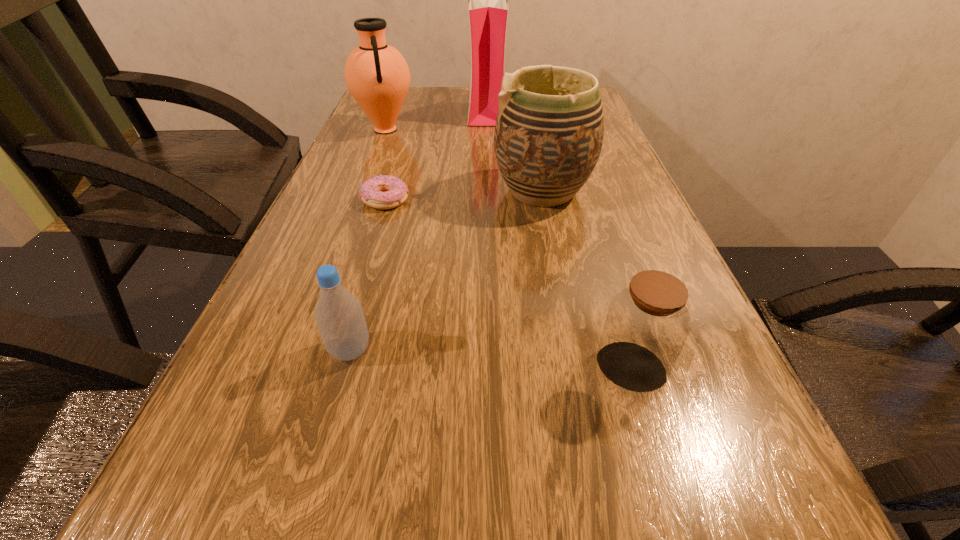
Locate an element on the screen. vacant region at the far edge of the desktop is located at coordinates (461, 104).

The height and width of the screenshot is (540, 960). Find the location of `free space at the left edge`. free space at the left edge is located at coordinates (261, 446).

The height and width of the screenshot is (540, 960). Find the location of `vacant area at the right edge of the desktop`. vacant area at the right edge of the desktop is located at coordinates pos(618,198).

In order to click on vacant space that is in between the bottle and the shopping bag in this screenshot , I will do `click(419, 230)`.

This screenshot has height=540, width=960. I want to click on blank region between the tallest object and the doughnut, so click(x=437, y=154).

Image resolution: width=960 pixels, height=540 pixels. I want to click on unoccupied position between the pottery and the bottle, so click(x=446, y=271).

Find the location of a particular element. Image resolution: width=960 pixels, height=540 pixels. free space between the doughnut and the shopping bag is located at coordinates (437, 154).

I want to click on free space that is in between the pitcher and the shopping bag, so click(x=436, y=119).

Identify the location of free space between the pottery and the bottle. [x=446, y=271].

This screenshot has width=960, height=540. I want to click on vacant space that's between the pitcher and the jar, so click(x=508, y=249).